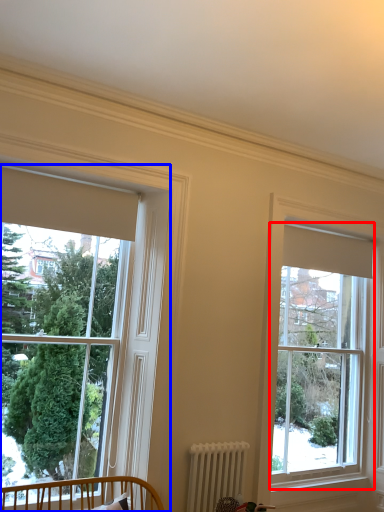
Question: Which point is further to the camera, window (highlighted by a red box) or window (highlighted by a blue box)?

Choices:
 (A) window
 (B) window

Answer: (A)